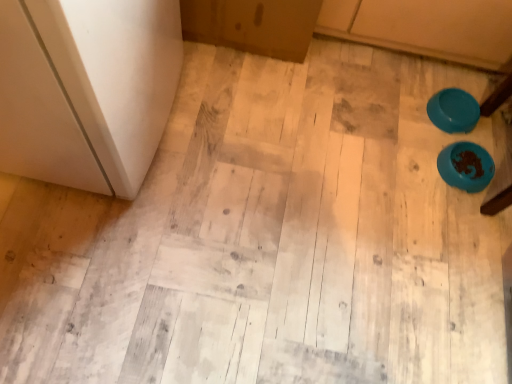
Identify the location of free region under teal glossy bowl at upper right, which is the 2th bowl in bottom-to-top order (from a real-world perspective). (452, 113).